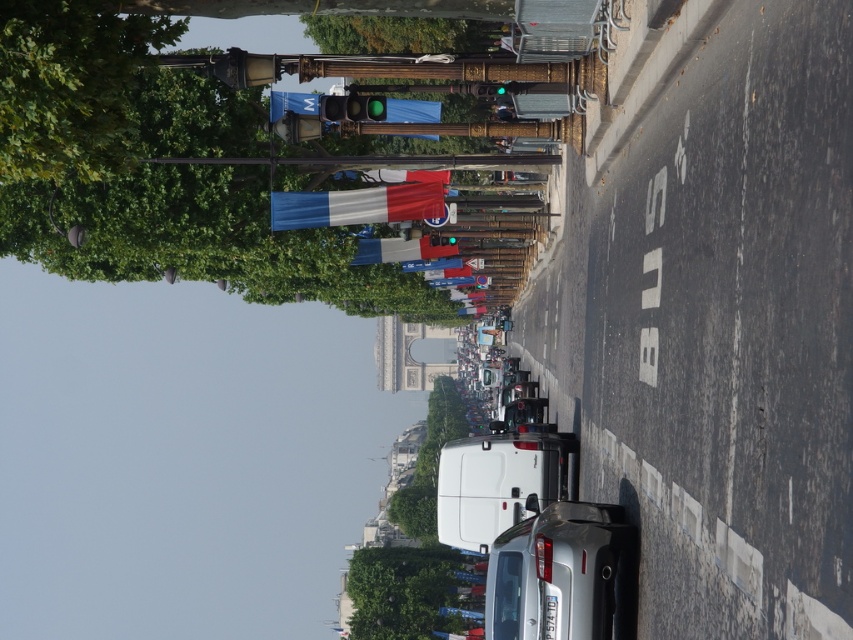
Question: Is the position of satin silver car at center more distant than that of matte fabric flag at center?

Choices:
 (A) yes
 (B) no

Answer: (B)

Question: Considering the relative positions of green leafy tree at lower center and green leafy tree at upper center in the image provided, where is green leafy tree at lower center located with respect to green leafy tree at upper center?

Choices:
 (A) above
 (B) below

Answer: (B)

Question: Which object appears closest to the camera in this image?

Choices:
 (A) green leafy tree at lower center
 (B) matte fabric flag at center

Answer: (B)

Question: Is green leafy tree at upper left positioned behind green leafy tree at lower center?

Choices:
 (A) no
 (B) yes

Answer: (A)

Question: Which object is closer to the camera taking this photo?

Choices:
 (A) green leafy tree at upper left
 (B) tricolor fabric flag at center

Answer: (A)

Question: Based on their relative distances, which object is farther from the tricolor fabric flag at center?

Choices:
 (A) green leafy tree at upper left
 (B) green leafy tree at upper center

Answer: (A)